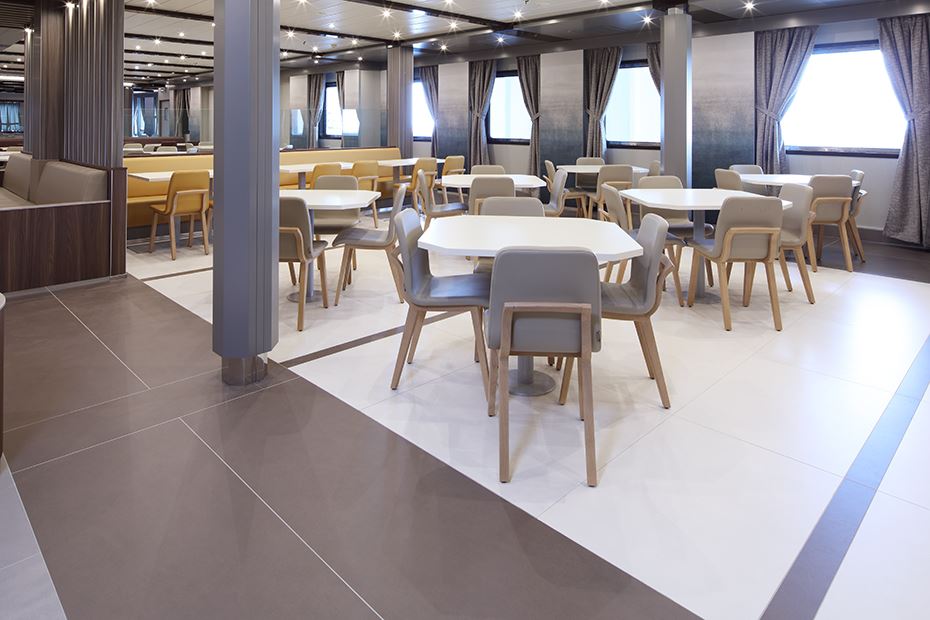
You are a GUI agent. You are given a task and a screenshot of the screen. Output one action in this format:
    pyautogui.click(x=<x>, y=<y>)
    Task: Click on the brown chairs
    
    Given the screenshot: What is the action you would take?
    pyautogui.click(x=188, y=190), pyautogui.click(x=323, y=167), pyautogui.click(x=365, y=164), pyautogui.click(x=427, y=162), pyautogui.click(x=453, y=160)